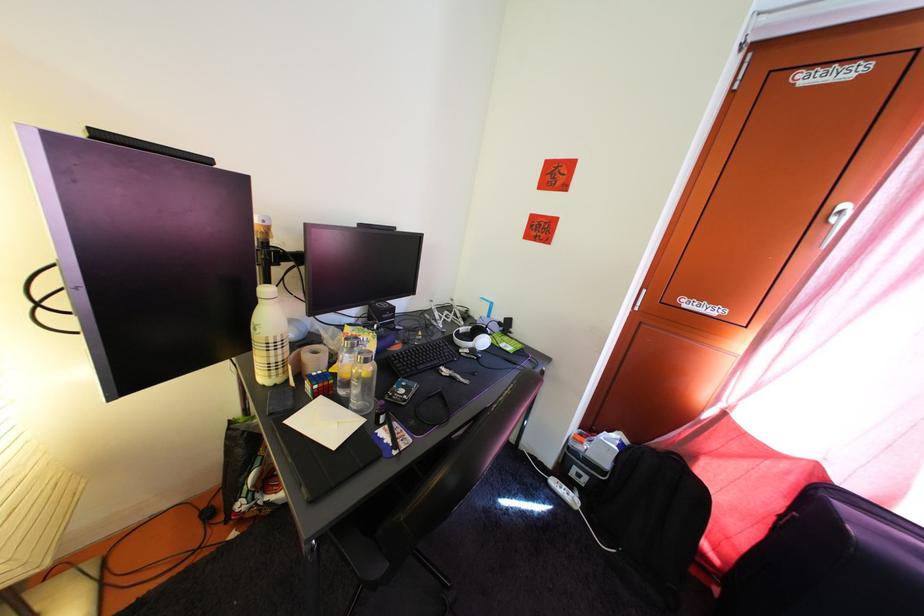
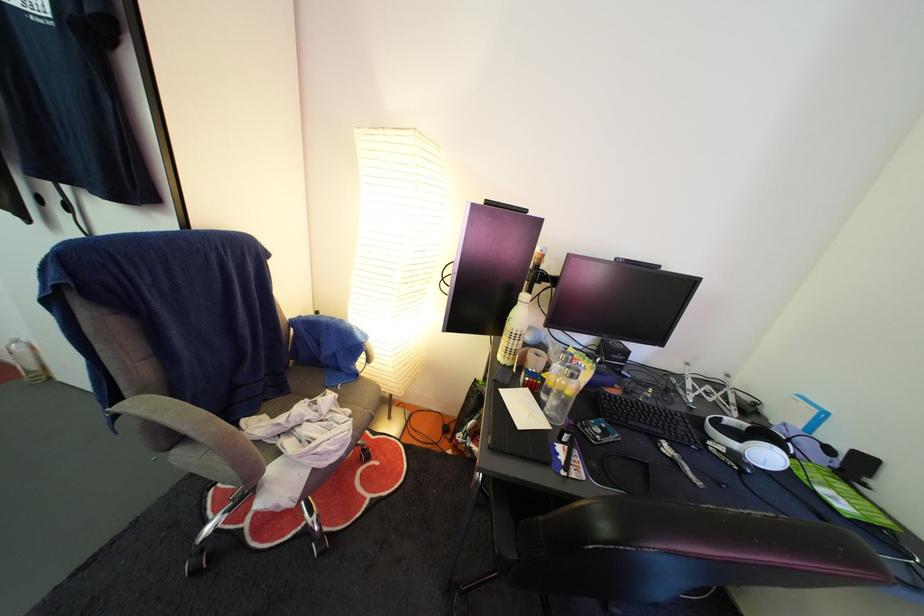
Where in the second image is the point corresponding to point (492, 351) from the first image?

(774, 464)